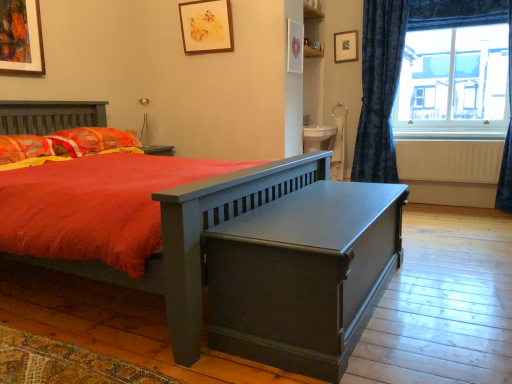
Question: Is matte dark green trunk at center bigger than matte wooden picture frame at upper center, positioned as the fourth picture frame in left-to-right order?

Choices:
 (A) no
 (B) yes

Answer: (B)

Question: Is matte dark green trunk at center at the right side of matte wooden picture frame at upper center, the 1th picture frame viewed from the back?

Choices:
 (A) yes
 (B) no

Answer: (B)

Question: Does matte dark green trunk at center have a greater height compared to matte wooden picture frame at upper center, the 1th picture frame viewed from the back?

Choices:
 (A) yes
 (B) no

Answer: (A)

Question: Is matte wooden picture frame at upper center, which appears as the 1th picture frame when viewed from the right, located within matte dark green trunk at center?

Choices:
 (A) no
 (B) yes

Answer: (A)

Question: Does matte dark green trunk at center lie behind matte wooden picture frame at upper center, which ranks as the 4th picture frame in front-to-back order?

Choices:
 (A) yes
 (B) no

Answer: (B)

Question: Considering the relative positions of matte dark green trunk at center and matte wooden picture frame at upper center, which appears as the 1th picture frame when viewed from the right, in the image provided, is matte dark green trunk at center to the left of matte wooden picture frame at upper center, which appears as the 1th picture frame when viewed from the right, from the viewer's perspective?

Choices:
 (A) no
 (B) yes

Answer: (B)

Question: From a real-world perspective, is fluffy orange pillow at left, which ranks as the first pillow in front-to-back order, located higher than white matte radiator at right?

Choices:
 (A) yes
 (B) no

Answer: (A)

Question: Is fluffy orange pillow at left, which ranks as the first pillow in front-to-back order, positioned beyond the bounds of white matte radiator at right?

Choices:
 (A) yes
 (B) no

Answer: (A)

Question: Can you confirm if fluffy orange pillow at left, which ranks as the first pillow in front-to-back order, is taller than white matte radiator at right?

Choices:
 (A) no
 (B) yes

Answer: (A)

Question: Can you confirm if fluffy orange pillow at left, which appears as the 2th pillow when viewed from the back, is shorter than white matte radiator at right?

Choices:
 (A) no
 (B) yes

Answer: (B)

Question: Considering the relative sizes of fluffy orange pillow at left, which ranks as the first pillow in front-to-back order, and white matte radiator at right in the image provided, is fluffy orange pillow at left, which ranks as the first pillow in front-to-back order, smaller than white matte radiator at right?

Choices:
 (A) yes
 (B) no

Answer: (B)

Question: From the image's perspective, does fluffy orange pillow at left, which ranks as the first pillow in front-to-back order, appear lower than white matte radiator at right?

Choices:
 (A) no
 (B) yes

Answer: (A)

Question: Is white matte radiator at right at the left side of matte wooden picture frame at upper center, which ranks as the 4th picture frame in front-to-back order?

Choices:
 (A) no
 (B) yes

Answer: (A)